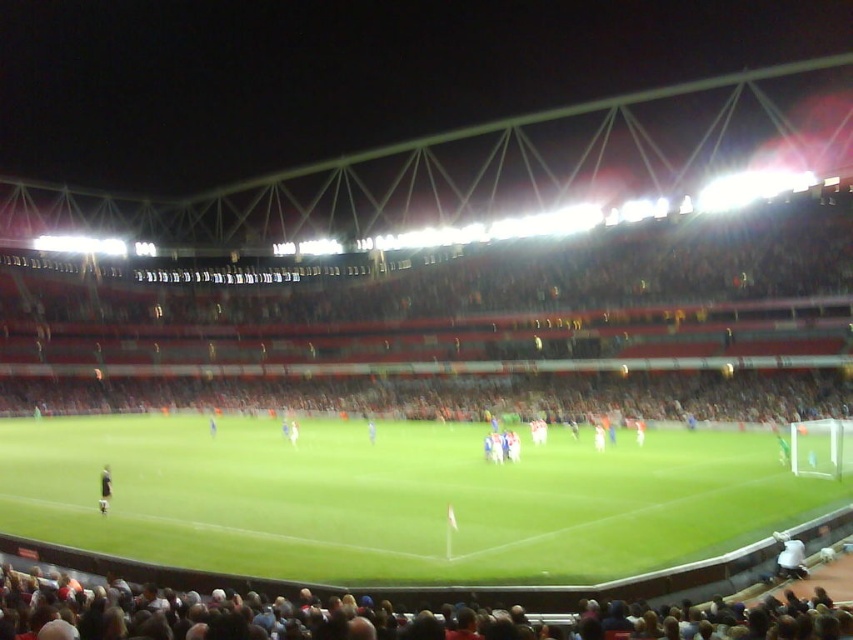
Who is taller, dark brown hair at lower center or white fabric at lower right?

Standing taller between the two is dark brown hair at lower center.

Between point (408, 630) and point (781, 564), which one is positioned behind?

Positioned behind is point (781, 564).

Identify the location of dark brown hair at lower center. (380, 616).

Is dark brown hair at lower center wider than white fabric person at center?

Indeed, dark brown hair at lower center has a greater width compared to white fabric person at center.

Is point (521, 627) positioned behind point (291, 433)?

No, (521, 627) is in front of (291, 433).

Is point (235, 600) more distant than point (289, 424)?

No, it is not.

Where is `dark brown hair at lower center`? dark brown hair at lower center is located at coordinates (380, 616).

Between green grass football field at center and white fabric person at center, which one appears on the left side from the viewer's perspective?

From the viewer's perspective, white fabric person at center appears more on the left side.

You are a GUI agent. You are given a task and a screenshot of the screen. Output one action in this format:
    pyautogui.click(x=<x>, y=<y>)
    Task: Click on the green grass football field at center
    This screenshot has height=640, width=853.
    Given the screenshot: What is the action you would take?
    pyautogui.click(x=397, y=499)

At what (x,y) coordinates should I click in order to perform the action: click on green grass football field at center. Please return your answer as a coordinate pair (x, y). Image resolution: width=853 pixels, height=640 pixels. Looking at the image, I should click on (397, 499).